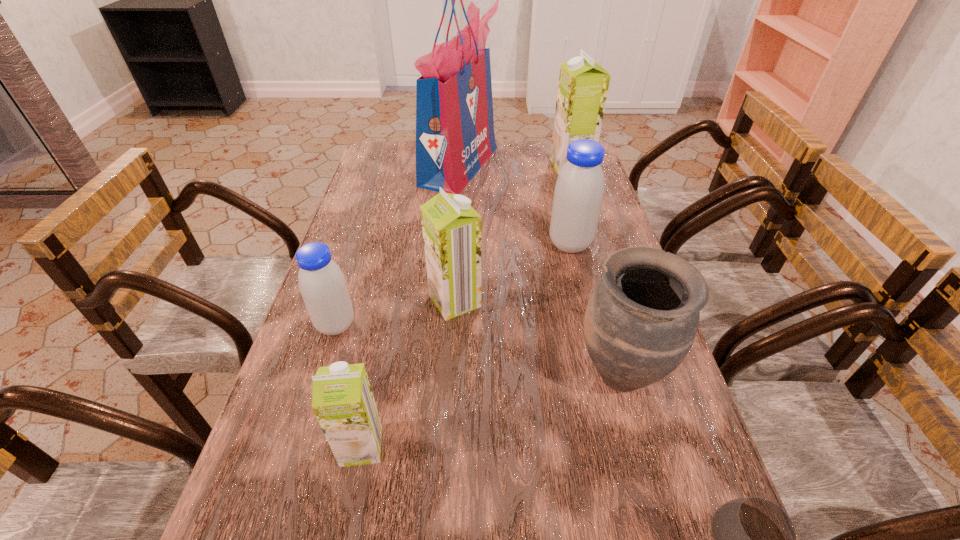
Identify the location of the tallest object. The image size is (960, 540). (455, 136).

What are the coordinates of `grocery bag` in the screenshot? It's located at (455, 136).

Locate an element on the screen. the farthest green soya milk is located at coordinates (583, 85).

At what (x,y) coordinates should I click in order to perform the action: click on the biggest green soya milk. Please return your answer as a coordinate pair (x, y). Looking at the image, I should click on (583, 85).

The image size is (960, 540). Find the location of `the third soya milk from right to left`. the third soya milk from right to left is located at coordinates (451, 228).

At what (x,y) coordinates should I click in order to perform the action: click on the second biggest green soya milk. Please return your answer as a coordinate pair (x, y). Image resolution: width=960 pixels, height=540 pixels. Looking at the image, I should click on (451, 228).

Where is `the bigger blue soya milk`? The image size is (960, 540). the bigger blue soya milk is located at coordinates (579, 190).

You are a GUI agent. You are given a task and a screenshot of the screen. Output one action in this format:
    pyautogui.click(x=<x>, y=<y>)
    Task: Click on the second farthest soya milk
    
    Given the screenshot: What is the action you would take?
    pyautogui.click(x=579, y=190)

This screenshot has height=540, width=960. Identify the location of urn. (641, 320).

Where is `the smaller blue soya milk`? This screenshot has height=540, width=960. the smaller blue soya milk is located at coordinates (322, 284).